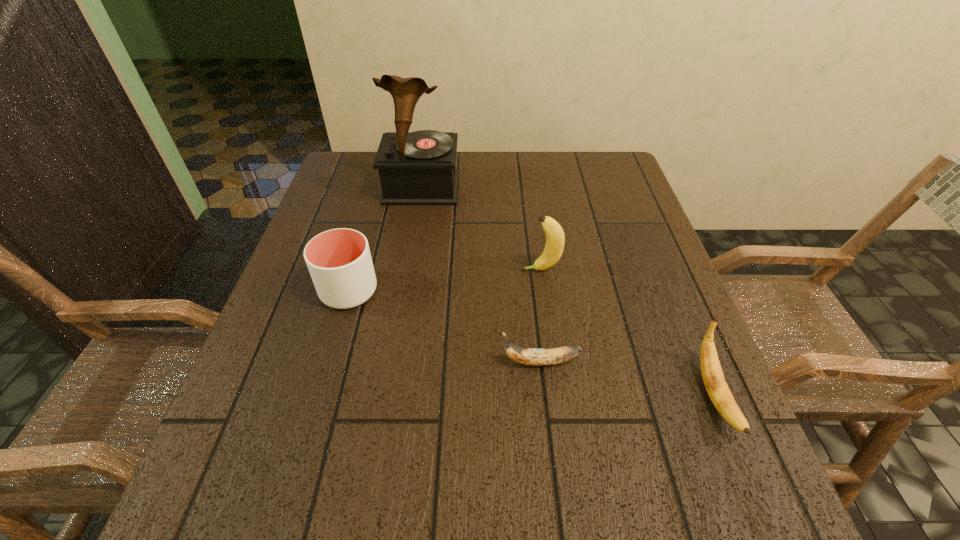
I want to click on object that is positioned at the far left corner, so click(x=416, y=168).

In the image, there is a desktop. Where is `free region at the far edge`? free region at the far edge is located at coordinates click(558, 190).

Image resolution: width=960 pixels, height=540 pixels. In the image, there is a desktop. Identify the location of blank space at the near edge. (355, 537).

Find the location of a particular element. This screenshot has width=960, height=540. vacant space at the left edge of the desktop is located at coordinates (300, 444).

In the image, there is a desktop. Where is `vacant space at the right edge`? Image resolution: width=960 pixels, height=540 pixels. vacant space at the right edge is located at coordinates (627, 315).

The height and width of the screenshot is (540, 960). In the image, there is a desktop. Find the location of `vacant space at the far left corner`. vacant space at the far left corner is located at coordinates (349, 161).

Identify the location of vacant space at the far right corner of the desktop. (630, 194).

Where is `free space between the second shortest banana and the cup`? This screenshot has height=540, width=960. free space between the second shortest banana and the cup is located at coordinates (531, 343).

The image size is (960, 540). I want to click on empty location between the fourth shortest object and the phonograph_record, so click(481, 229).

Locate an element on the screen. free space between the shortest object and the tallest banana is located at coordinates (540, 316).